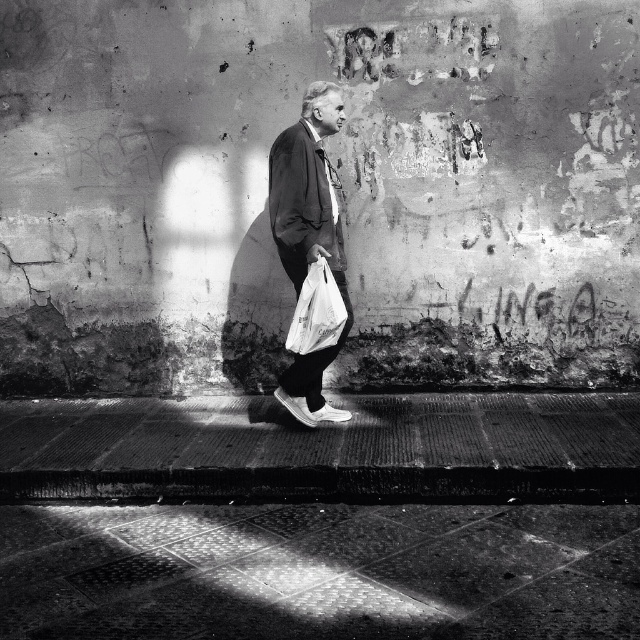
Based on the photo, based on the scene described, which object, the matte black jacket at center or the white plastic bag at lower center, has a greater width?

The matte black jacket at center has a greater width than the white plastic bag at lower center.

You are a photographer trying to capture the matte black jacket at center in the image. Based on its position, where should you focus your camera to ensure it is in the frame?

You should focus your camera at point (308,236) to capture the matte black jacket at center.

You are a photographer trying to capture the man and his shadow in the image. The polished stone pavement at lower center and the matte black jacket at center are both in your viewfinder. Which object is closer to the camera?

The polished stone pavement at lower center is closer to the camera because it is positioned below the matte black jacket at center, indicating it is lower in the visual plane and thus nearer to the viewer.